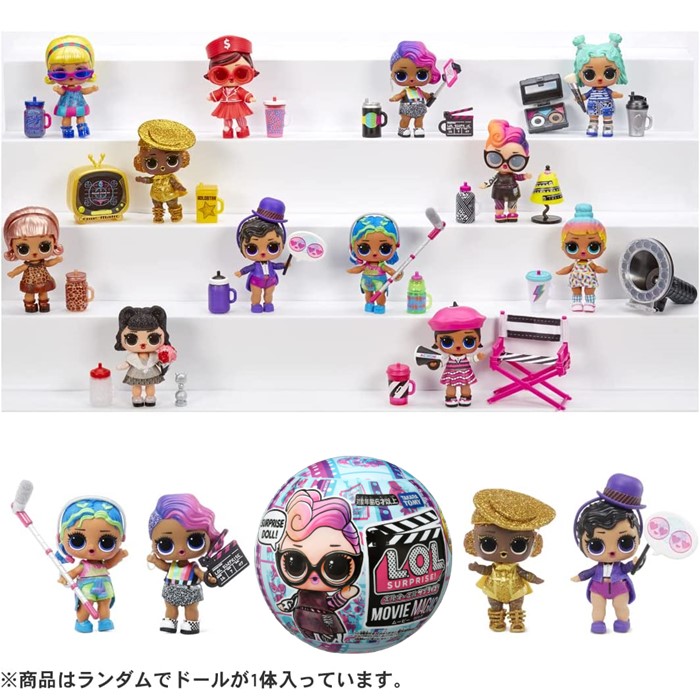
The width and height of the screenshot is (700, 700). What are the coordinates of `dolls that are not wearing hats` in the screenshot? It's located at (91, 547), (178, 540), (141, 350), (32, 265), (374, 252), (505, 162), (70, 80), (410, 85), (598, 92).